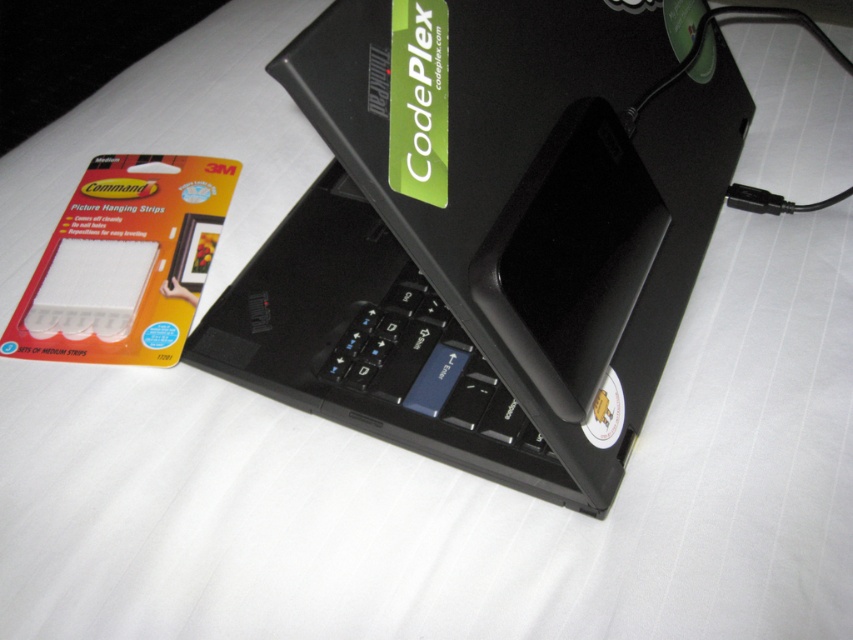
Is black plastic laptop at center thinner than black matte keyboard at center?

No, black plastic laptop at center is not thinner than black matte keyboard at center.

Between black plastic laptop at center and black matte keyboard at center, which one has less height?

black matte keyboard at center is shorter.

Is point (375, 385) farther from viewer compared to point (473, 404)?

Yes.

The height and width of the screenshot is (640, 853). I want to click on black plastic laptop at center, so click(490, 240).